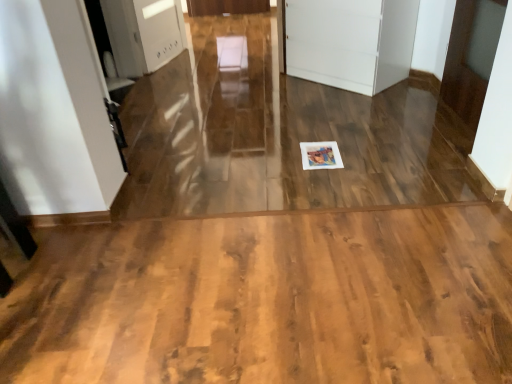
What are the coordinates of `free location in front of white matte cabinet at center, which is the 2th door from right to left` in the screenshot? It's located at (354, 106).